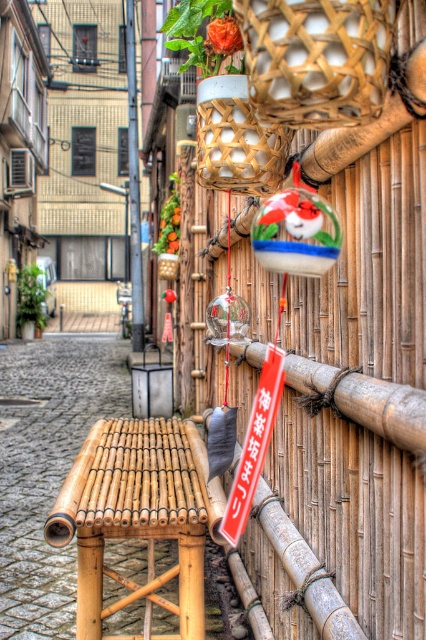
You are standing in the alleyway and want to place a small potted plant. The bamboo woven basket at center is represented by point (236, 140). Where should you place the plant so it doesn not block the basket?

The bamboo woven basket at center is located at point (236, 140). To avoid blocking it, place the plant away from that coordinate.

You are a visitor in this alleyway and want to place a small potted plant on the ground between the bamboo woven basket at center and the bamboo sign at center. Which object should you place it closer to so that the plant is not hidden by either object?

The bamboo woven basket at center is shorter than the bamboo sign at center, so placing the plant closer to the bamboo woven basket at center would prevent it from being hidden by the taller bamboo sign at center.

You are a visitor in this traditional alleyway and want to sit down on the natural bamboo stool at center. However, you notice a metallic pole at upper center above it. Do you think the pole might pose a safety risk if you sit there?

The natural bamboo stool at center is below the metallic pole at upper center. Since the pole is positioned above the stool, there is a potential safety risk if the pole were to fall or if you hit your head while sitting. It would be wise to exercise caution.